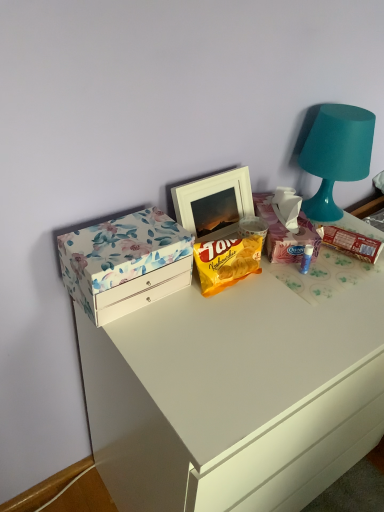
The height and width of the screenshot is (512, 384). What do you see at coordinates (234, 396) in the screenshot?
I see `white glossy drawer at upper left` at bounding box center [234, 396].

Measure the distance between point (328, 129) and camera.

A distance of 3.44 feet exists between point (328, 129) and camera.

What do you see at coordinates (226, 262) in the screenshot?
I see `yellow matte snack packet at center, the first snack when ordered from left to right` at bounding box center [226, 262].

Measure the distance between floral paper box at left and camera.

floral paper box at left and camera are 29.82 inches apart.

This screenshot has height=512, width=384. Describe the element at coordinates (125, 263) in the screenshot. I see `floral paper box at left` at that location.

Identify the location of matte white picture frame at center. This screenshot has width=384, height=512. (214, 203).

From a real-world perspective, who is located higher, teal matte lamp at upper right or floral cardboard box at upper right?

In real-world perspective, teal matte lamp at upper right is above.

Based on the photo, visually, is teal matte lamp at upper right positioned to the left or to the right of floral cardboard box at upper right?

In the image, teal matte lamp at upper right appears on the right side of floral cardboard box at upper right.

Is point (304, 206) closer to camera compared to point (270, 207)?

No, it is not.

In terms of width, does teal matte lamp at upper right look wider or thinner when compared to floral cardboard box at upper right?

In the image, teal matte lamp at upper right appears to be more narrow than floral cardboard box at upper right.

From the image's perspective, is yellow matte snack packet at center, which is counted as the second snack, starting from the right, positioned above or below teal matte lamp at upper right?

yellow matte snack packet at center, which is counted as the second snack, starting from the right, is below teal matte lamp at upper right.

Is yellow matte snack packet at center, which is counted as the second snack, starting from the right, oriented away from teal matte lamp at upper right?

That's not correct — yellow matte snack packet at center, which is counted as the second snack, starting from the right, is not looking away from teal matte lamp at upper right.

Is yellow matte snack packet at center, which is counted as the second snack, starting from the right, spatially inside teal matte lamp at upper right, or outside of it?

yellow matte snack packet at center, which is counted as the second snack, starting from the right, is spatially situated outside teal matte lamp at upper right.

Can you confirm if yellow matte snack packet at center, which is counted as the second snack, starting from the right, is shorter than teal matte lamp at upper right?

Yes, yellow matte snack packet at center, which is counted as the second snack, starting from the right, is shorter than teal matte lamp at upper right.

Who is shorter, brown cardboard snack at right, which ranks as the 1th snack in right-to-left order, or yellow matte snack packet at center, which is counted as the second snack, starting from the right?

With less height is brown cardboard snack at right, which ranks as the 1th snack in right-to-left order.

From the picture: How different are the orientations of brown cardboard snack at right, marked as the second snack in a left-to-right arrangement, and yellow matte snack packet at center, which is counted as the second snack, starting from the right, in degrees?

The angular difference between brown cardboard snack at right, marked as the second snack in a left-to-right arrangement, and yellow matte snack packet at center, which is counted as the second snack, starting from the right, is 16.1 degrees.

Is yellow matte snack packet at center, which is counted as the second snack, starting from the right, at the back of brown cardboard snack at right, marked as the second snack in a left-to-right arrangement?

brown cardboard snack at right, marked as the second snack in a left-to-right arrangement, is not turned away from yellow matte snack packet at center, which is counted as the second snack, starting from the right.

From a real-world perspective, is brown cardboard snack at right, which ranks as the 1th snack in right-to-left order, physically located above or below yellow matte snack packet at center, which is counted as the second snack, starting from the right?

brown cardboard snack at right, which ranks as the 1th snack in right-to-left order, is situated lower than yellow matte snack packet at center, which is counted as the second snack, starting from the right, in the real world.

What's the angular difference between matte white picture frame at center and brown cardboard snack at right, which ranks as the 1th snack in right-to-left order,'s facing directions?

The angular difference between matte white picture frame at center and brown cardboard snack at right, which ranks as the 1th snack in right-to-left order, is 16.1 degrees.

Considering the sizes of objects matte white picture frame at center and brown cardboard snack at right, which ranks as the 1th snack in right-to-left order, in the image provided, who is taller, matte white picture frame at center or brown cardboard snack at right, which ranks as the 1th snack in right-to-left order,?

Standing taller between the two is matte white picture frame at center.

Measure the distance between matte white picture frame at center and brown cardboard snack at right, which ranks as the 1th snack in right-to-left order.

A distance of 28.47 centimeters exists between matte white picture frame at center and brown cardboard snack at right, which ranks as the 1th snack in right-to-left order.

Is matte white picture frame at center inside or outside of brown cardboard snack at right, marked as the second snack in a left-to-right arrangement?

matte white picture frame at center is not enclosed by brown cardboard snack at right, marked as the second snack in a left-to-right arrangement.

Does matte white picture frame at center have a greater height compared to floral cardboard box at upper right?

Yes.

Between matte white picture frame at center and floral cardboard box at upper right, which one has larger width?

floral cardboard box at upper right.

Is floral cardboard box at upper right a part of matte white picture frame at center?

No, floral cardboard box at upper right is not surrounded by matte white picture frame at center.

How much distance is there between matte white picture frame at center and floral cardboard box at upper right?

matte white picture frame at center is 4.90 inches from floral cardboard box at upper right.

Based on the photo, from the image's perspective, is brown cardboard snack at right, marked as the second snack in a left-to-right arrangement, over teal matte lamp at upper right?

No, from the image's perspective, brown cardboard snack at right, marked as the second snack in a left-to-right arrangement, is not on top of teal matte lamp at upper right.

Considering the sizes of objects brown cardboard snack at right, which ranks as the 1th snack in right-to-left order, and teal matte lamp at upper right in the image provided, who is wider, brown cardboard snack at right, which ranks as the 1th snack in right-to-left order, or teal matte lamp at upper right?

teal matte lamp at upper right.

In the scene shown: From a real-world perspective, between brown cardboard snack at right, which ranks as the 1th snack in right-to-left order, and teal matte lamp at upper right, who is vertically higher?

teal matte lamp at upper right is physically above.

Do you think brown cardboard snack at right, marked as the second snack in a left-to-right arrangement, is within teal matte lamp at upper right, or outside of it?

brown cardboard snack at right, marked as the second snack in a left-to-right arrangement, is located beyond the bounds of teal matte lamp at upper right.

Is yellow matte snack packet at center, which is counted as the second snack, starting from the right, located outside brown cardboard snack at right, which ranks as the 1th snack in right-to-left order?

Indeed, yellow matte snack packet at center, which is counted as the second snack, starting from the right, is completely outside brown cardboard snack at right, which ranks as the 1th snack in right-to-left order.

From a real-world perspective, which object stands above the other?

From a 3D spatial view, yellow matte snack packet at center, which is counted as the second snack, starting from the right, is above.

Is yellow matte snack packet at center, which is counted as the second snack, starting from the right, next to brown cardboard snack at right, marked as the second snack in a left-to-right arrangement?

No, yellow matte snack packet at center, which is counted as the second snack, starting from the right, is not making contact with brown cardboard snack at right, marked as the second snack in a left-to-right arrangement.

Can you confirm if yellow matte snack packet at center, which is counted as the second snack, starting from the right, is taller than brown cardboard snack at right, which ranks as the 1th snack in right-to-left order?

Yes, yellow matte snack packet at center, which is counted as the second snack, starting from the right, is taller than brown cardboard snack at right, which ranks as the 1th snack in right-to-left order.

In the image, there is a teal matte lamp at upper right. Identify the location of storage box below it (from a real-world perspective). (284, 233).

Where is `lamp above the yellow matte snack packet at center, the first snack when ordered from left to right (from a real-world perspective)`? The width and height of the screenshot is (384, 512). lamp above the yellow matte snack packet at center, the first snack when ordered from left to right (from a real-world perspective) is located at coordinates (336, 155).

Based on their spatial positions, is floral cardboard box at upper right or white glossy drawer at upper left further from teal matte lamp at upper right?

white glossy drawer at upper left.

Which object lies nearer to the anchor point white glossy drawer at upper left, floral paper box at left or matte white picture frame at center?

floral paper box at left is closer to white glossy drawer at upper left.

Which object lies nearer to the anchor point brown cardboard snack at right, marked as the second snack in a left-to-right arrangement, white glossy drawer at upper left or yellow matte snack packet at center, which is counted as the second snack, starting from the right?

Based on the image, yellow matte snack packet at center, which is counted as the second snack, starting from the right, appears to be nearer to brown cardboard snack at right, marked as the second snack in a left-to-right arrangement.

When comparing their distances from matte white picture frame at center, does brown cardboard snack at right, which ranks as the 1th snack in right-to-left order, or yellow matte snack packet at center, which is counted as the second snack, starting from the right, seem closer?

The object closer to matte white picture frame at center is yellow matte snack packet at center, which is counted as the second snack, starting from the right.

Which object lies nearer to the anchor point yellow matte snack packet at center, the first snack when ordered from left to right, floral cardboard box at upper right or white glossy drawer at upper left?

floral cardboard box at upper right lies closer to yellow matte snack packet at center, the first snack when ordered from left to right, than the other object.

When comparing their distances from floral cardboard box at upper right, does teal matte lamp at upper right or yellow matte snack packet at center, which is counted as the second snack, starting from the right, seem closer?

yellow matte snack packet at center, which is counted as the second snack, starting from the right, lies closer to floral cardboard box at upper right than the other object.

Looking at the image, which one is located further to white glossy drawer at upper left, yellow matte snack packet at center, the first snack when ordered from left to right, or brown cardboard snack at right, which ranks as the 1th snack in right-to-left order?

brown cardboard snack at right, which ranks as the 1th snack in right-to-left order, is further to white glossy drawer at upper left.

When comparing their distances from brown cardboard snack at right, marked as the second snack in a left-to-right arrangement, does teal matte lamp at upper right or floral paper box at left seem further?

floral paper box at left is further to brown cardboard snack at right, marked as the second snack in a left-to-right arrangement.

Find the location of a particular element. picture frame between teal matte lamp at upper right and white glossy drawer at upper left from top to bottom is located at coordinates click(x=214, y=203).

Find the location of a particular element. Image resolution: width=384 pixels, height=512 pixels. picture frame between floral paper box at left and teal matte lamp at upper right is located at coordinates (214, 203).

This screenshot has height=512, width=384. In order to click on storage box between matte white picture frame at center and brown cardboard snack at right, marked as the second snack in a left-to-right arrangement, from left to right in this screenshot , I will do `click(284, 233)`.

Identify the location of box between teal matte lamp at upper right and white glossy drawer at upper left vertically. The height and width of the screenshot is (512, 384). (125, 263).